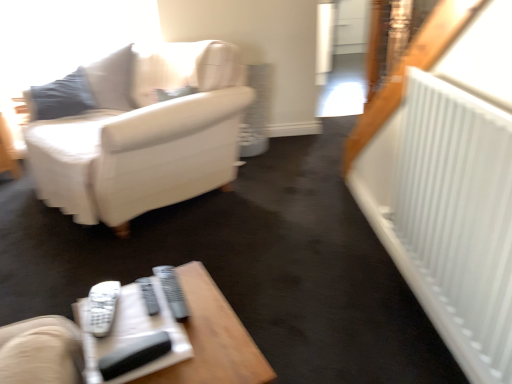
At what (x,y) coordinates should I click in order to perform the action: click on space that is in front of white leather couch at upper left. Please return your answer as a coordinate pair (x, y). Looking at the image, I should click on (153, 264).